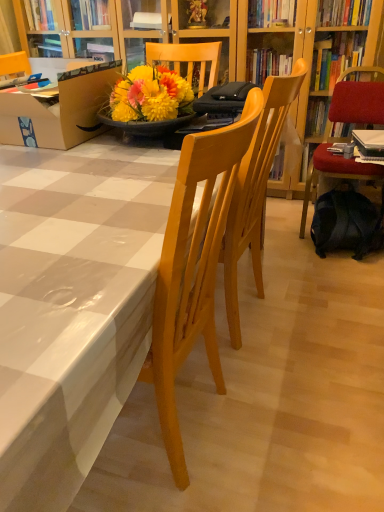
Question: From the image's perspective, is light wood chair at center, which appears as the first chair when viewed from the left, beneath brown cardboard box at left?

Choices:
 (A) no
 (B) yes

Answer: (B)

Question: Is the depth of light wood chair at center, the 2th chair viewed from the right, greater than that of brown cardboard box at left?

Choices:
 (A) no
 (B) yes

Answer: (A)

Question: Is light wood chair at center, which appears as the first chair when viewed from the left, shorter than brown cardboard box at left?

Choices:
 (A) yes
 (B) no

Answer: (B)

Question: Does light wood chair at center, the second chair when ordered from back to front, lie in front of brown cardboard box at left?

Choices:
 (A) yes
 (B) no

Answer: (A)

Question: Considering the relative sizes of light wood chair at center, the second chair when ordered from back to front, and brown cardboard box at left in the image provided, is light wood chair at center, the second chair when ordered from back to front, wider than brown cardboard box at left?

Choices:
 (A) no
 (B) yes

Answer: (A)

Question: Is brown cardboard box at left to the left of light wood chair at center, which is the first chair from front to back, from the viewer's perspective?

Choices:
 (A) yes
 (B) no

Answer: (A)

Question: Is brown cardboard box at left bigger than light wood chair at center, the second chair when ordered from back to front?

Choices:
 (A) yes
 (B) no

Answer: (B)

Question: Are brown cardboard box at left and light wood chair at center, the second chair when ordered from back to front, making contact?

Choices:
 (A) yes
 (B) no

Answer: (B)

Question: Does brown cardboard box at left have a greater width compared to light wood chair at center, the 2th chair viewed from the right?

Choices:
 (A) yes
 (B) no

Answer: (A)

Question: Is brown cardboard box at left further to the viewer compared to light wood chair at center, the 2th chair viewed from the right?

Choices:
 (A) yes
 (B) no

Answer: (A)

Question: Does brown cardboard box at left appear on the right side of light wood chair at center, which is the first chair from front to back?

Choices:
 (A) yes
 (B) no

Answer: (B)

Question: Is black fabric backpack at lower right wider than brown cardboard box at left?

Choices:
 (A) no
 (B) yes

Answer: (A)